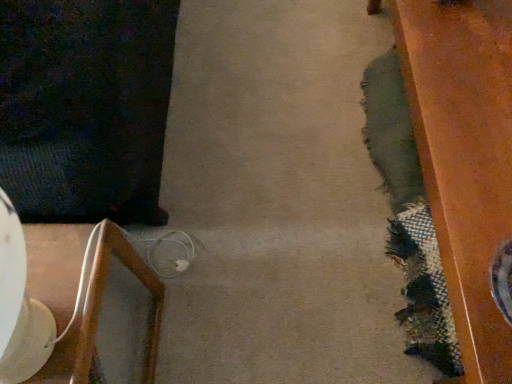
Find the location of a particular element. white glossy lampshade at left is located at coordinates (100, 311).

What do you see at coordinates (100, 311) in the screenshot?
I see `white glossy lampshade at left` at bounding box center [100, 311].

Locate an element on the screen. This screenshot has height=384, width=512. white glossy lampshade at left is located at coordinates (100, 311).